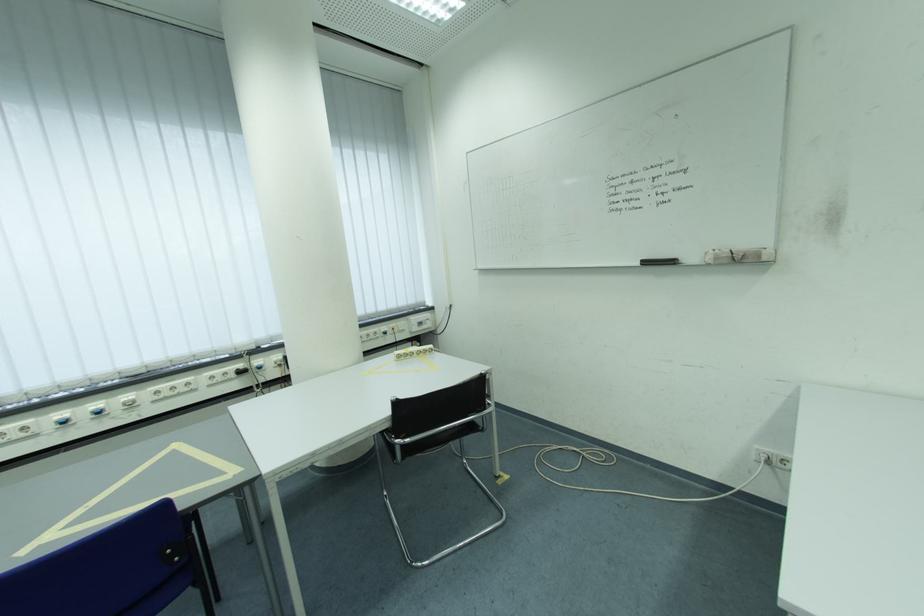
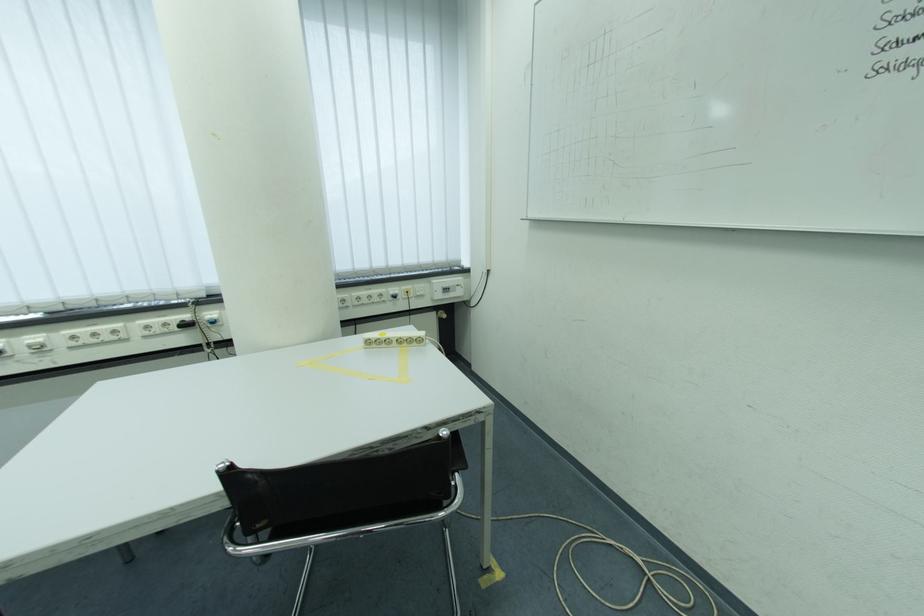
Find the pixel in the second image that matches point (266, 363) in the first image.

(217, 315)